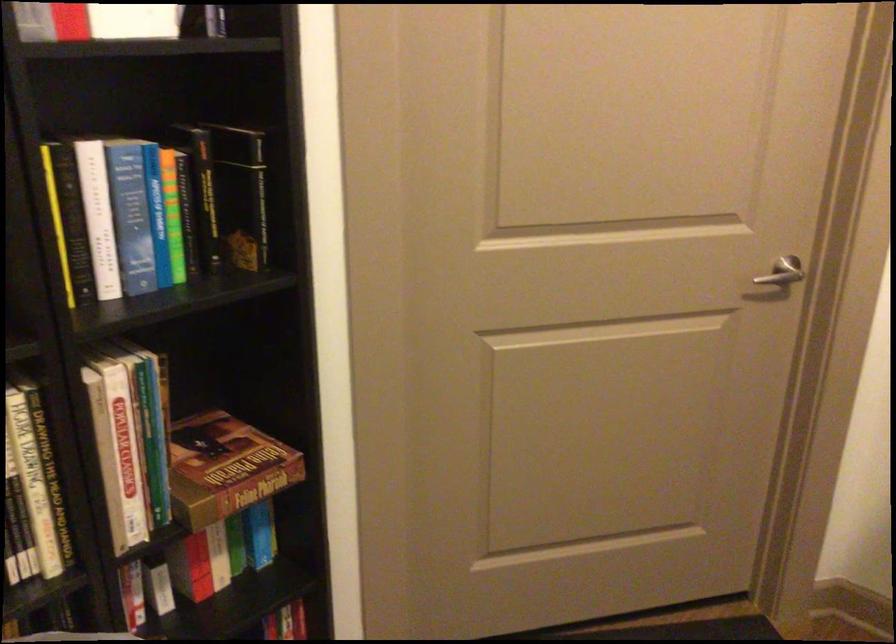
Which object does [156,214] point to?

It corresponds to the blue spine book in the image.